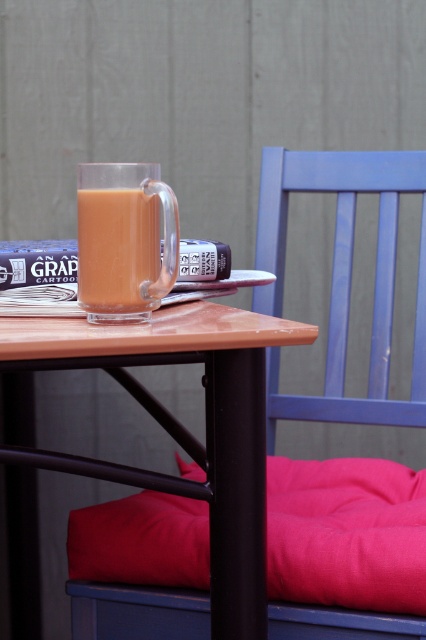
The height and width of the screenshot is (640, 426). Describe the element at coordinates (173, 424) in the screenshot. I see `wooden table at center` at that location.

Does wooden table at center have a greater width compared to matte blue chair at center?

Yes.

Locate an element on the screen. Image resolution: width=426 pixels, height=640 pixels. wooden table at center is located at coordinates (173, 424).

The height and width of the screenshot is (640, 426). Find the location of `wooden table at center`. wooden table at center is located at coordinates (173, 424).

Can you confirm if matte blue chair at center is positioned above translucent glass mug at upper center?

Actually, matte blue chair at center is below translucent glass mug at upper center.

Between matte blue chair at center and translucent glass mug at upper center, which one is positioned higher?

translucent glass mug at upper center is above.

Locate an element on the screen. matte blue chair at center is located at coordinates (342, 278).

Can you confirm if velvety pink pillow at lower right is positioned to the left of matte blue chair at center?

Indeed, velvety pink pillow at lower right is positioned on the left side of matte blue chair at center.

Locate an element on the screen. The width and height of the screenshot is (426, 640). velvety pink pillow at lower right is located at coordinates (347, 532).

In order to click on velvety pink pillow at lower right in this screenshot , I will do `click(347, 532)`.